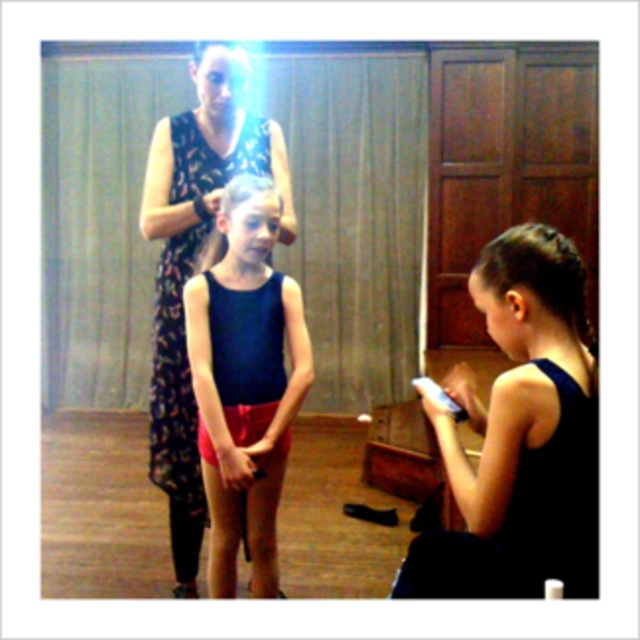
Between matte black tank top at lower right and blonde silky hair at center, which one is positioned higher?

blonde silky hair at center is above.

Can you confirm if matte black tank top at lower right is taller than blonde silky hair at center?

Yes, matte black tank top at lower right is taller than blonde silky hair at center.

In order to click on matte black tank top at lower right in this screenshot , I will do `click(520, 435)`.

Is the position of floral-patterned fabric dress at center less distant than that of blonde silky hair at upper center?

That is True.

Is floral-patterned fabric dress at center bigger than blonde silky hair at upper center?

Yes.

Is point (164, 360) in front of point (198, 56)?

No.

Locate an element on the screen. floral-patterned fabric dress at center is located at coordinates (176, 376).

Which is more to the left, blonde silky hair at center or blonde silky hair at upper center?

blonde silky hair at upper center

In the scene shown: Is blonde silky hair at center bigger than blonde silky hair at upper center?

Correct, blonde silky hair at center is larger in size than blonde silky hair at upper center.

Does point (260, 184) come in front of point (246, 65)?

Yes, point (260, 184) is closer to viewer.

Where is `blonde silky hair at center`? blonde silky hair at center is located at coordinates (244, 192).